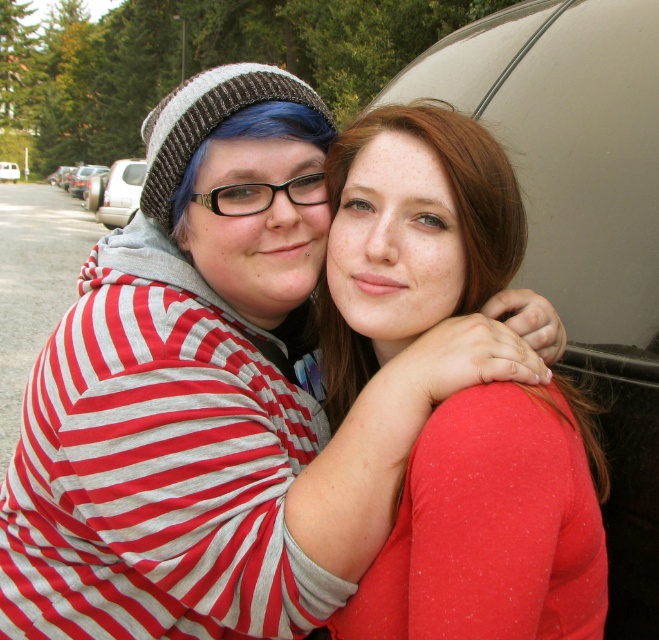
You are standing between the two people in the image. You want to move to the silver metallic car at left without disturbing them. What is the minimum distance you need to walk to reach the car?

The minimum distance you need to walk to reach the silver metallic car at left is 16.73 meters.

You are a photographer trying to capture a photo of the matte red sweater at center and the silver metallic car at left. Which object should you focus on first if you want to include both in the frame without moving the camera?

The matte red sweater at center is positioned on the right side of the silver metallic car at left, so you should focus on the silver metallic car at left first to ensure both objects are within the frame.

You are a photographer setting up for a photo shoot. You have two silver metallic cars in the scene. The silver metallic car at left and the metallic silver car at center. You need to choose one car to place a large poster on its hood. Which car should you choose to ensure the poster is clearly visible in the photo?

The silver metallic car at left is bigger than the metallic silver car at center, so choosing the silver metallic car at left will ensure the poster on its hood is more clearly visible in the photo.